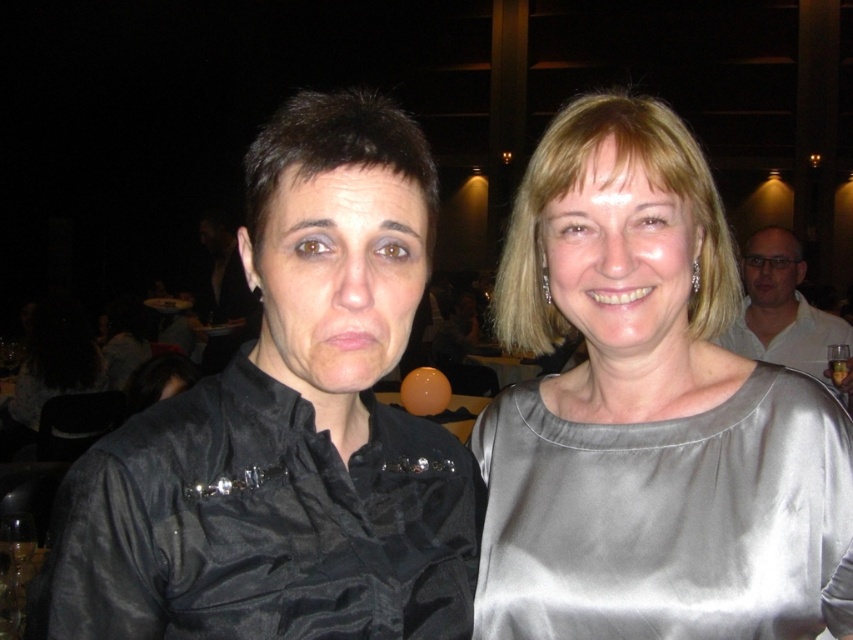
Is the position of satin gray face at center more distant than that of matte white face at upper right?

That is False.

Based on the photo, between satin gray face at center and matte white face at upper right, which one appears on the left side from the viewer's perspective?

Positioned to the left is satin gray face at center.

What do you see at coordinates (619, 257) in the screenshot? I see `satin gray face at center` at bounding box center [619, 257].

This screenshot has width=853, height=640. What are the coordinates of `satin gray face at center` in the screenshot? It's located at (619, 257).

Looking at this image, does satin gray blouse at upper right have a greater width compared to satin gray face at center?

Correct, the width of satin gray blouse at upper right exceeds that of satin gray face at center.

What are the coordinates of `satin gray blouse at upper right` in the screenshot? It's located at tap(647, 412).

Does point (357, 262) come in front of point (566, 212)?

Yes, it is.

Does matte black face at center come behind satin gray face at center?

No, it is in front of satin gray face at center.

Which is in front, point (300, 324) or point (676, 237)?

Point (300, 324)

Identify the location of matte black face at center. The width and height of the screenshot is (853, 640). point(337,276).